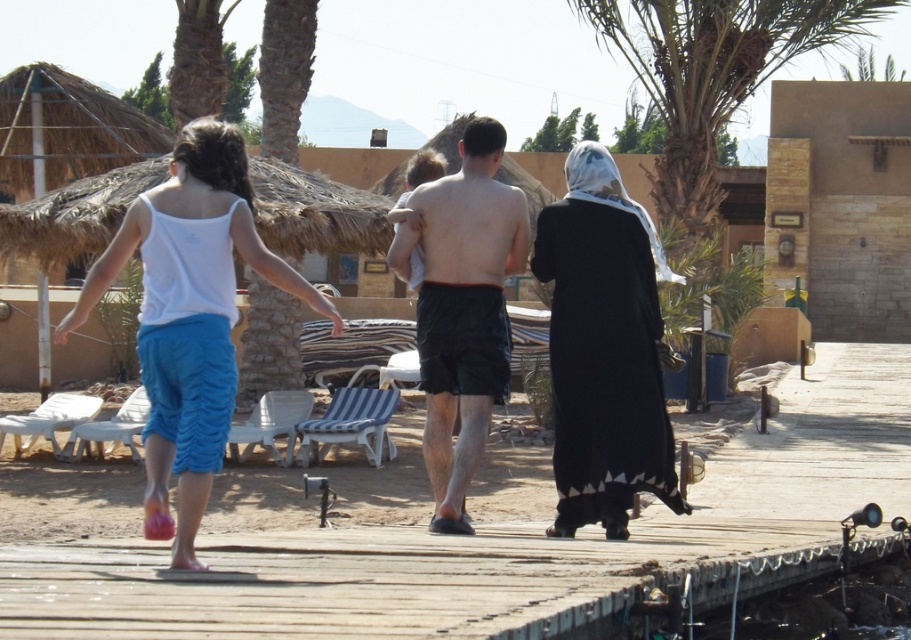
You are a photographer trying to capture a photo of the white cotton tank top at upper left and the green leafy palm tree at upper center in the background. Since you want both subjects to be in focus, which one should you focus on first to ensure the other is also sharp?

You should focus on the green leafy palm tree at upper center first because it is farther away than the white cotton tank top at upper left, ensuring both will be in focus when using depth of field.

You are a photographer standing at the resort and want to take a photo that includes both the white cotton tank top at upper left and the green leafy palm tree at upper center. Given that your camera has a maximum zoom range of 5 meters, will you be able to capture both objects in the same frame without moving closer?

The white cotton tank top at upper left and green leafy palm tree at upper center are 17.90 meters apart. Since the camera can only zoom up to 5 meters, it cannot capture both objects in the same frame without moving closer.

In the resort scene, you see a young girl wearing a white cotton tank top at upper left and a woman wearing a black cotton dress at center. Which clothing item is positioned more to the right?

The white cotton tank top at upper left is positioned more to the right than the black cotton dress at center.